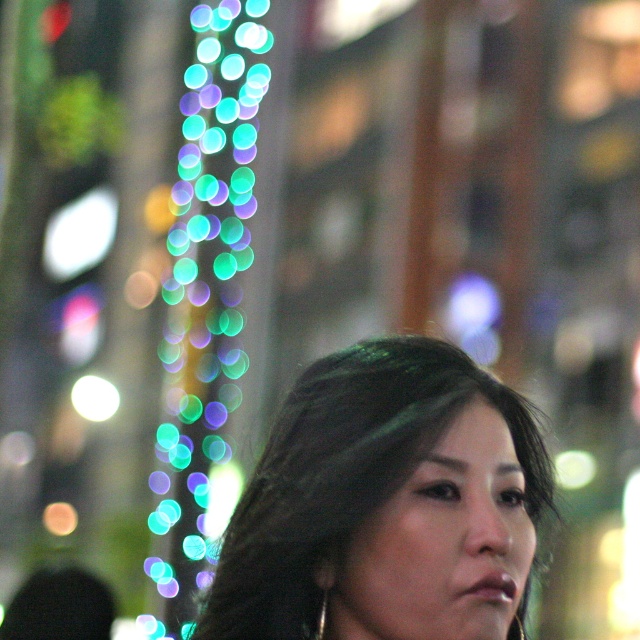
Is smooth dark hair at center smaller than multicolored glass beads at left?

Indeed, smooth dark hair at center has a smaller size compared to multicolored glass beads at left.

Consider the image. Between smooth dark hair at center and multicolored glass beads at left, which one is positioned lower?

smooth dark hair at center is below.

Locate an element on the screen. This screenshot has width=640, height=640. smooth dark hair at center is located at coordinates (371, 502).